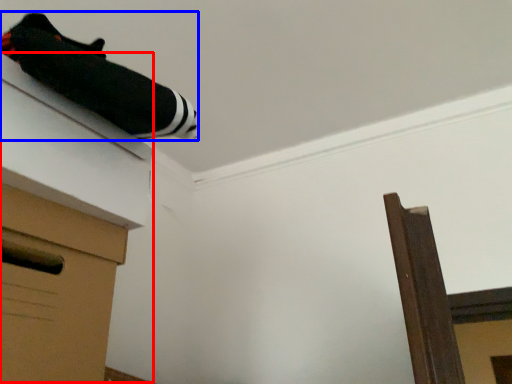
Question: Which point is closer to the camera, vanity (highlighted by a red box) or twin (highlighted by a blue box)?

Choices:
 (A) vanity
 (B) twin

Answer: (B)